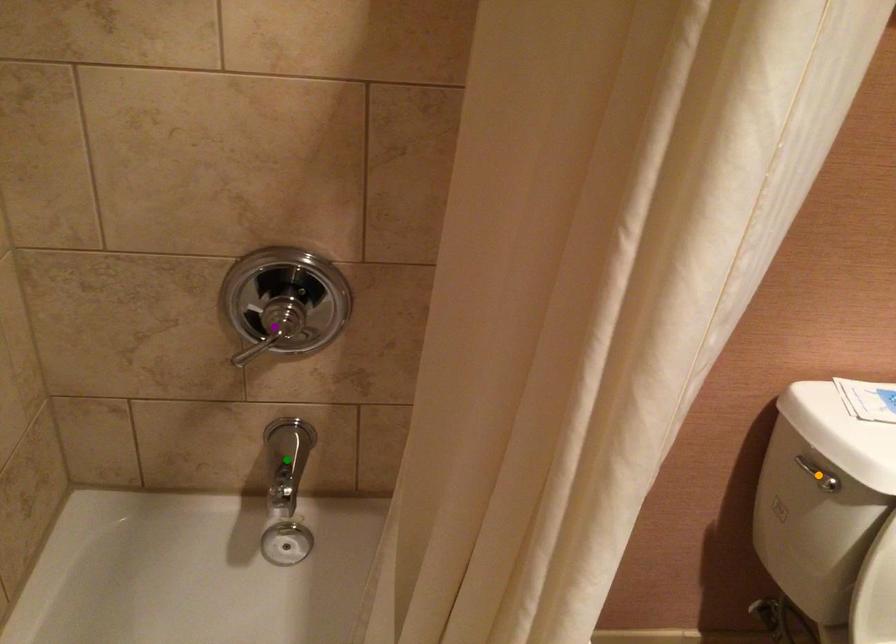
From the picture: Order these from farthest to nearest:
1. orange point
2. purple point
3. green point

green point
orange point
purple point